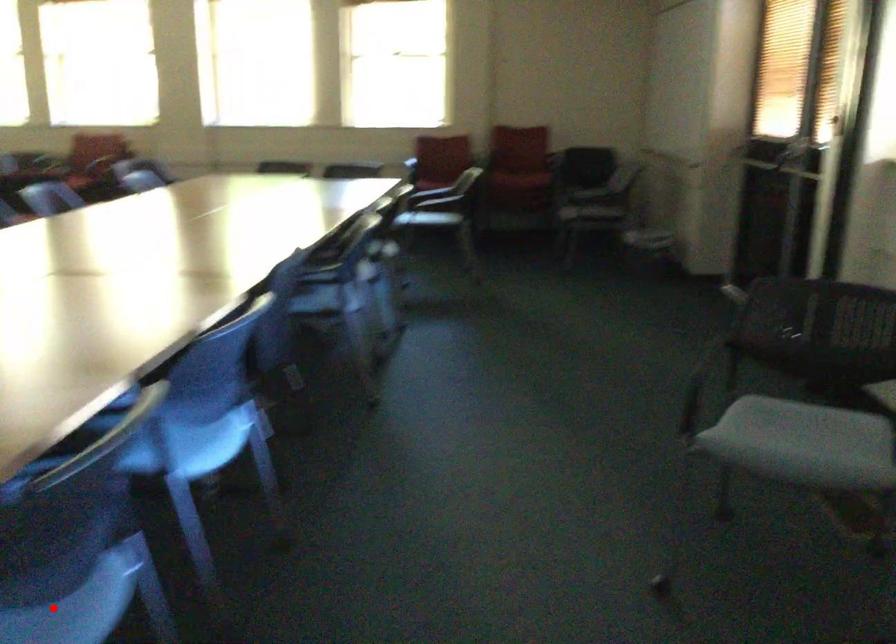
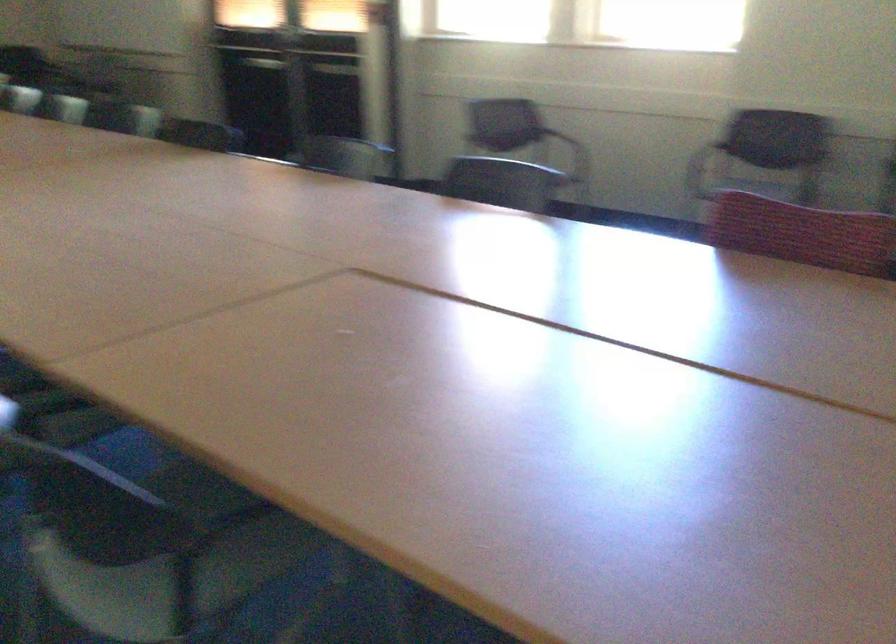
Question: I am providing you with two images of the same scene from different viewpoints. A red point is marked on the first image. Can you still see the location of the red point in image 2?

Choices:
 (A) Yes
 (B) No

Answer: (B)